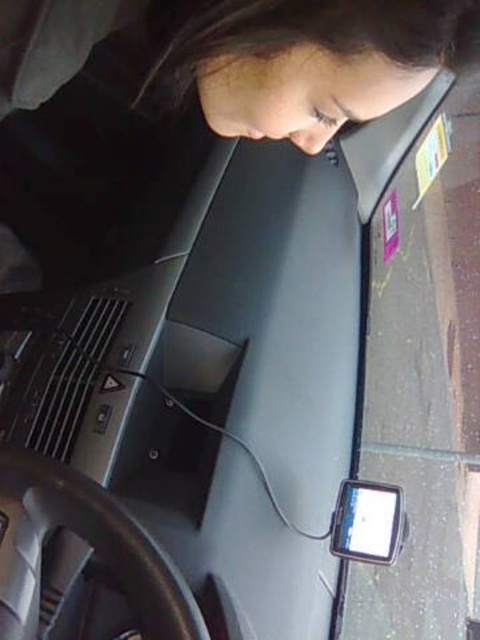
Question: Which object is closer to the camera taking this photo?

Choices:
 (A) matte black smartphone at lower right
 (B) matte black laptop at center

Answer: (B)

Question: Is matte black laptop at center positioned at the back of matte black smartphone at lower right?

Choices:
 (A) yes
 (B) no

Answer: (B)

Question: Can you confirm if matte black laptop at center is positioned above matte black smartphone at lower right?

Choices:
 (A) yes
 (B) no

Answer: (A)

Question: Among these objects, which one is farthest from the camera?

Choices:
 (A) matte black smartphone at lower right
 (B) matte black laptop at center

Answer: (A)

Question: Is matte black laptop at center closer to the viewer compared to matte black smartphone at lower right?

Choices:
 (A) no
 (B) yes

Answer: (B)